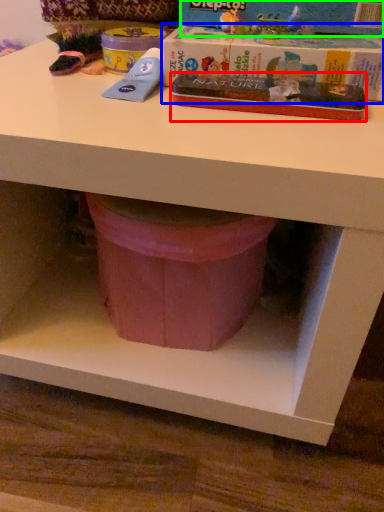
Question: Considering the real-world distances, which object is farthest from paperback book (highlighted by a red box)? paperback book (highlighted by a blue box) or paperback book (highlighted by a green box)?

Choices:
 (A) paperback book
 (B) paperback book

Answer: (B)